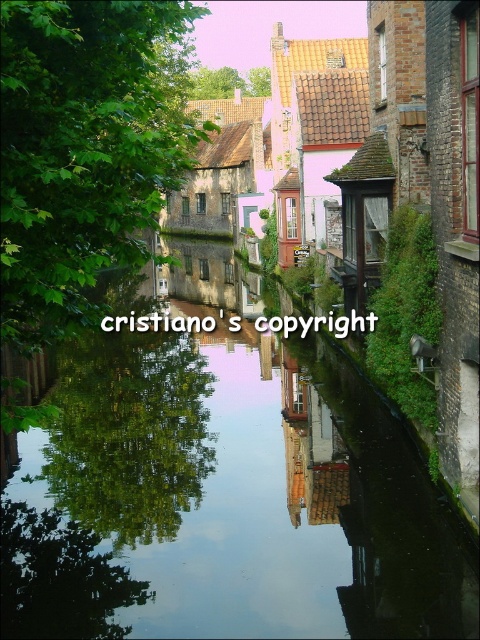
Question: Which point is closer to the camera taking this photo?

Choices:
 (A) (224, 604)
 (B) (264, 83)
 (C) (12, 332)

Answer: (C)

Question: Among these points, which one is nearest to the camera?

Choices:
 (A) [x=259, y=88]
 (B) [x=120, y=68]
 (C) [x=392, y=525]

Answer: (B)

Question: Is green reflective water at center positioned in front of green leafy tree at center?

Choices:
 (A) yes
 (B) no

Answer: (B)

Question: Which point is farther to the camera?

Choices:
 (A) green reflective water at center
 (B) green leafy tree at upper center

Answer: (B)

Question: Does green reflective water at center have a greater width compared to green leafy tree at upper center?

Choices:
 (A) yes
 (B) no

Answer: (A)

Question: Is green reflective water at center smaller than green leafy tree at center?

Choices:
 (A) no
 (B) yes

Answer: (B)